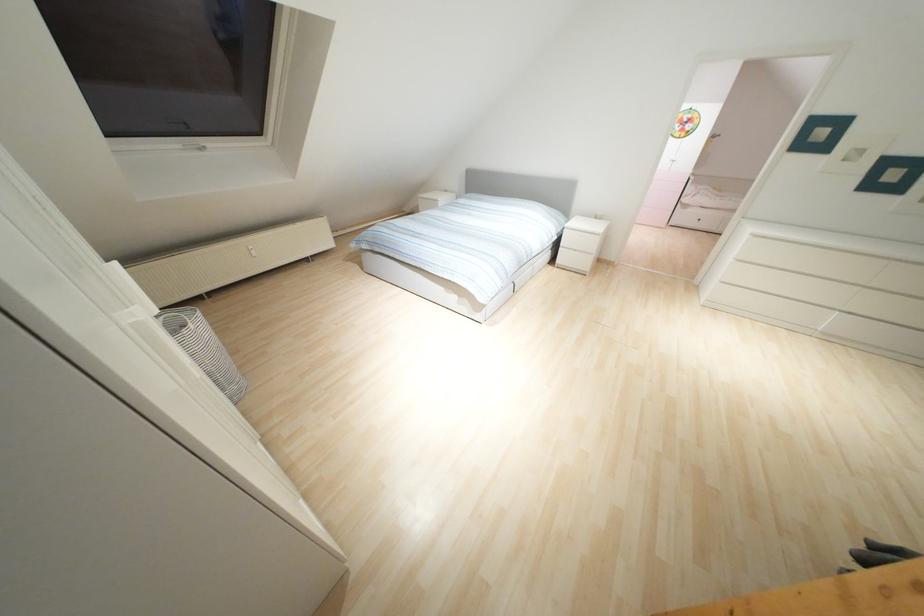
The width and height of the screenshot is (924, 616). Describe the element at coordinates (251, 251) in the screenshot. I see `the white radiator knob` at that location.